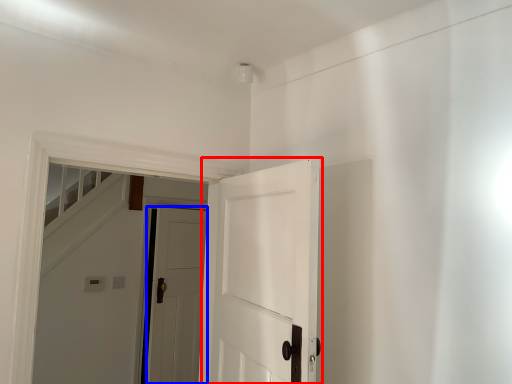
Question: Among these objects, which one is farthest to the camera, door (highlighted by a red box) or door (highlighted by a blue box)?

Choices:
 (A) door
 (B) door

Answer: (B)